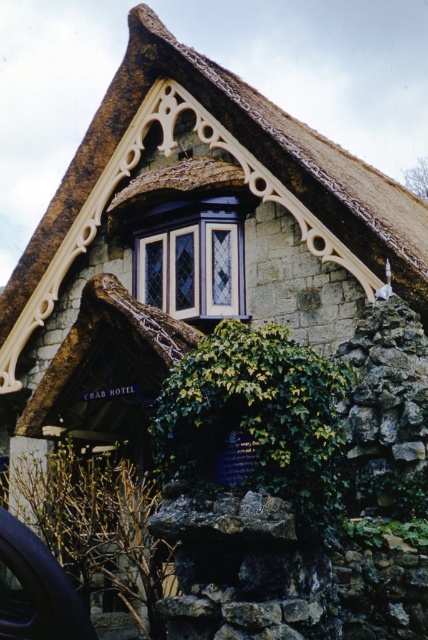
You are a photographer planning to take a wide shot of the Crab Hotel. You want to ensure both the green leafy ivy at center and the shiny black car at lower left are in the frame. Based on their positions, which object is closer to the camera, and why?

The shiny black car at lower left is closer to the camera because objects lower in the image are typically nearer to the viewer, while the green leafy ivy at center is positioned higher up, suggesting it is farther away.

Looking at this image, you are driving a car and want to park as close as possible to the Crab Hotel entrance without blocking the view of the thatched straw roof at upper center from the transparent glass car window at lower left. What is the minimum distance you should keep between your car and the building?

The minimum distance you should keep between your car and the building is 27.91 meters to ensure the thatched straw roof at upper center remains visible from the transparent glass car window at lower left.

From the picture: You are standing in front of the Crab Hotel and need to determine the relative positions of two points marked on the building. Which point is closer to you, point 1 at coordinates (x=264, y=488) or point 2 at coordinates (x=44, y=612)?

Point 2 at coordinates (x=44, y=612) is closer to you because point 1 at coordinates (x=264, y=488) is further away from the camera.